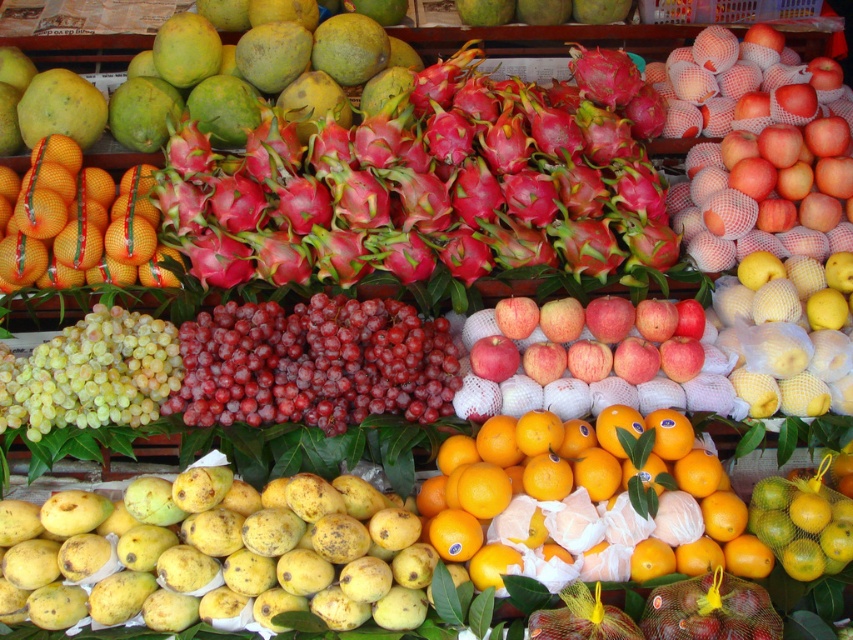
You are a customer at the fruit stand and want to pick up the red matte dragonfruit at center and orangesmoothorange at center. Which fruit should you reach for first to grab the one closer to you?

You should reach for the red matte dragonfruit at center first because it is closer to you than the orangesmoothorange at center, as stated in the description.

You are standing in front of a fruit stand and see the yellow matte mango at lower left and the red matte apples at center. Which fruit is nearer to you?

The yellow matte mango at lower left is closer to the viewer than the red matte apples at center.